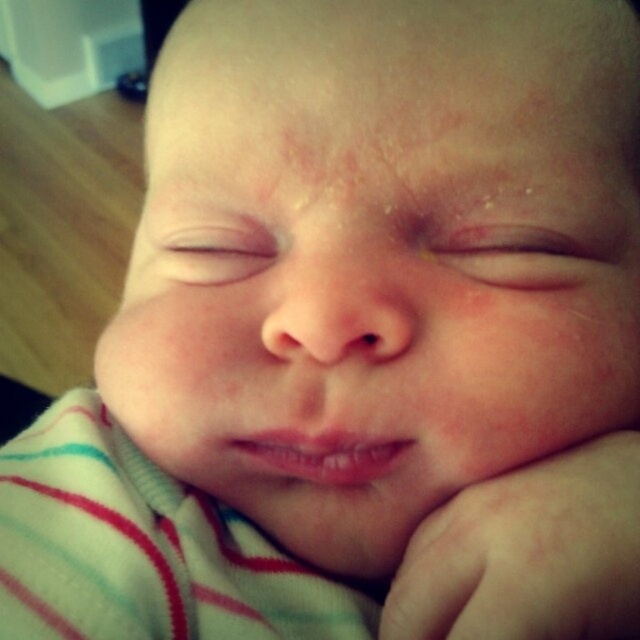
Question: Is pink smooth skin at center smaller than pink smooth eye at center?

Choices:
 (A) yes
 (B) no

Answer: (B)

Question: Which object is closer to the camera taking this photo?

Choices:
 (A) dry skin at center
 (B) smooth skin hand at lower right
 (C) pink smooth skin at center

Answer: (B)

Question: Which point is closer to the camera?

Choices:
 (A) (499, 560)
 (B) (232, 264)

Answer: (A)

Question: Is pink smooth skin at center smaller than pink smooth eye at center?

Choices:
 (A) no
 (B) yes

Answer: (A)

Question: Observing the image, what is the correct spatial positioning of smooth skin hand at lower right in reference to dry skin at center?

Choices:
 (A) below
 (B) above

Answer: (A)

Question: Which of the following is the farthest from the observer?

Choices:
 (A) pink smooth skin at center
 (B) dry skin at center
 (C) smooth skin hand at lower right

Answer: (B)